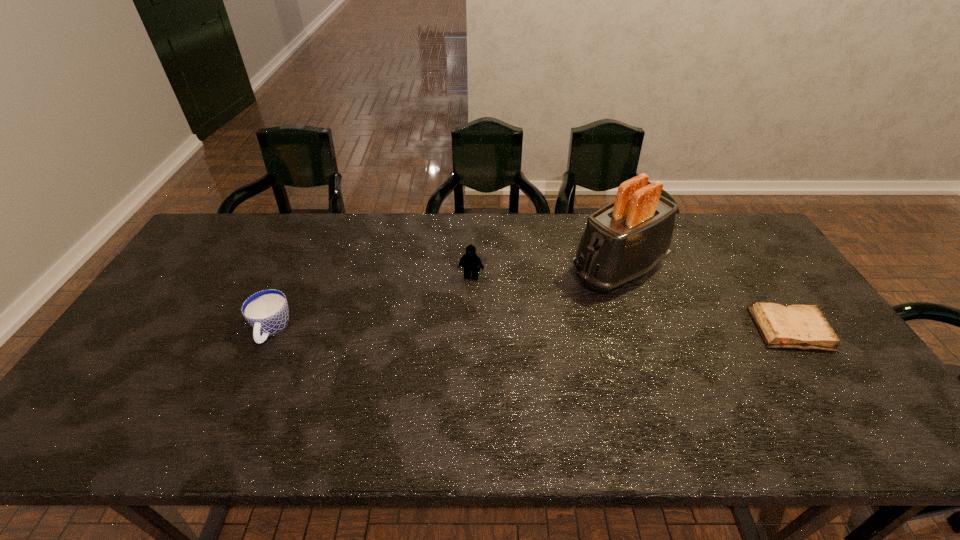
Identify the location of vacant space on the desktop that is between the leftmost object and the rightmost object and is positioned on the side of the second object from right to left with the control lever. This screenshot has height=540, width=960. (513, 330).

Locate an element on the screen. free space on the desktop that is between the third tallest object and the diary and is positioned on the face of the Lego is located at coordinates (454, 330).